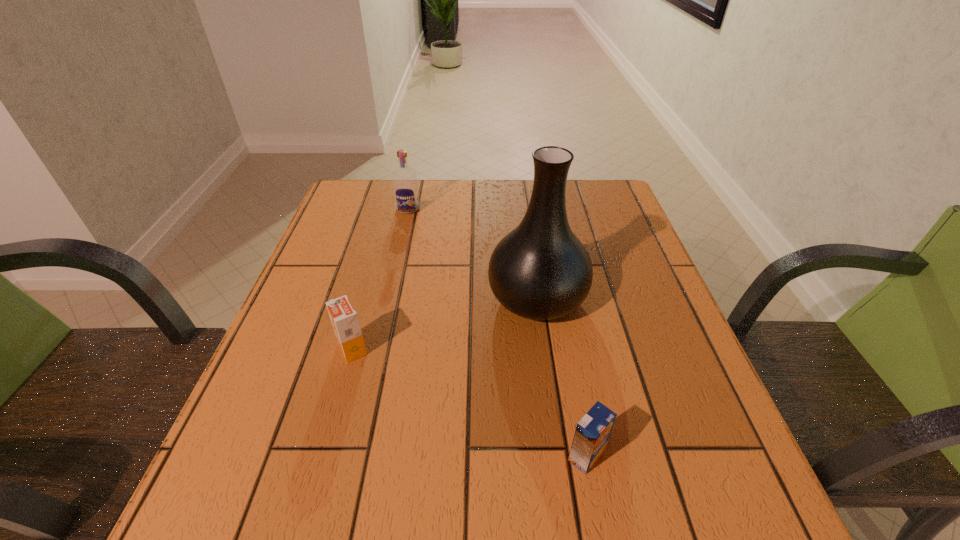
The height and width of the screenshot is (540, 960). What are the coordinates of `free space between the second nearest object and the tallest object` in the screenshot? It's located at (444, 323).

Select which object appears as the closest to the left orange_juice. Please provide its 2D coordinates. Your answer should be formatted as a tuple, i.e. [(x, y)], where the tuple contains the x and y coordinates of a point satisfying the conditions above.

[(540, 270)]

Identify which object is located as the second nearest to the farthest object. Please provide its 2D coordinates. Your answer should be formatted as a tuple, i.e. [(x, y)], where the tuple contains the x and y coordinates of a point satisfying the conditions above.

[(344, 319)]

You are a GUI agent. You are given a task and a screenshot of the screen. Output one action in this format:
    pyautogui.click(x=<x>, y=<y>)
    Task: Click on the free space that satisfies the following two spatial constraints: 1. on the label of the tallest object; 2. on the left side of the farthest object
    The image size is (960, 540).
    Given the screenshot: What is the action you would take?
    pyautogui.click(x=388, y=298)

At what (x,y) coordinates should I click in order to perform the action: click on vacant position in the image that satisfies the following two spatial constraints: 1. on the label of the second tallest object; 2. on the right side of the right orange_juice. Please return your answer as a coordinate pair (x, y). The image size is (960, 540). Looking at the image, I should click on 352,456.

The height and width of the screenshot is (540, 960). What are the coordinates of `free spot that satisfies the following two spatial constraints: 1. on the label of the farthest object; 2. on the left side of the second farthest object` in the screenshot? It's located at (388, 298).